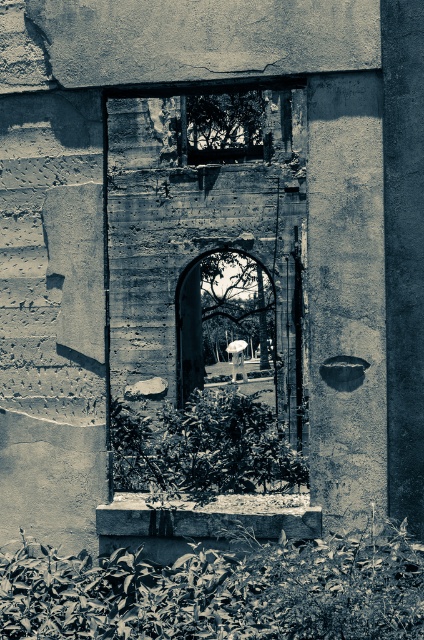
Consider the image. You are a photographer standing at the entrance of the arched doorway. You want to take a photo of the green leafy plant at center so that it fills the frame without any distortion. Given that your camera has a minimum focusing distance of 5 meters, can you take the photo from your current position?

The green leafy plant at center is 6.55 meters from the camera, which is beyond the minimum focusing distance of 5 meters. Therefore, you can take the photo from your current position without distortion.

You are standing at the entrance of the weathered stone structure and want to move towards the point that is closer to you. Which point should you head towards, point (74, 616) or point (262, 108)?

Point (74, 616) is in front of point 0.169, 0.175, so you should head towards point (74, 616).

You are standing in front of the stone structure with the arched doorway. You notice a point marked at coordinates (220, 592). What is this point located on?

The point at (220, 592) is located on leathery green leaves at lower center.